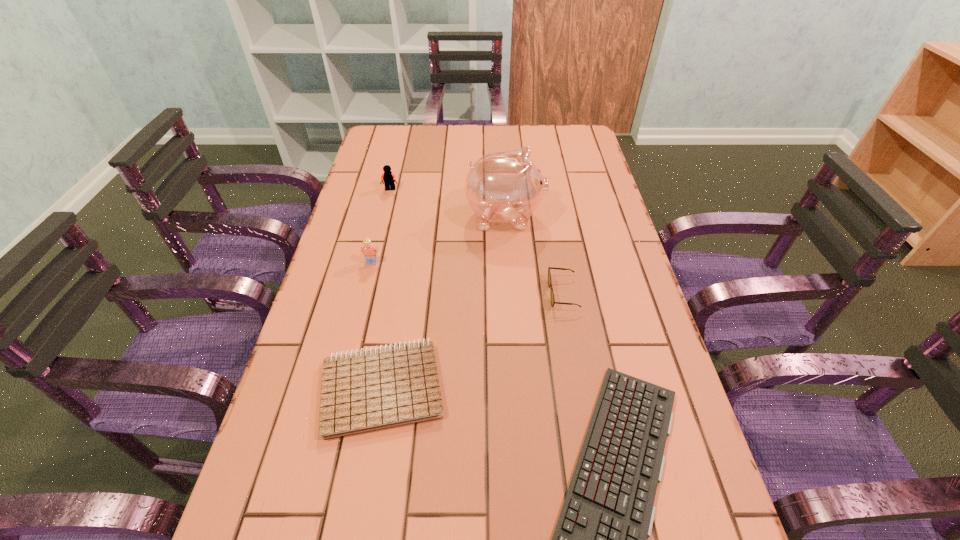
Locate an element on the screen. Image resolution: width=960 pixels, height=540 pixels. free space that satisfies the following two spatial constraints: 1. on the front facing side of the tallest object; 2. on the front-facing side of the farther Lego is located at coordinates (503, 190).

The width and height of the screenshot is (960, 540). Find the location of `vacant area in the image that satisfies the following two spatial constraints: 1. on the front-facing side of the farther Lego; 2. on the front facing side of the piggy bank`. vacant area in the image that satisfies the following two spatial constraints: 1. on the front-facing side of the farther Lego; 2. on the front facing side of the piggy bank is located at coordinates (384, 216).

Find the location of a particular element. free point that satisfies the following two spatial constraints: 1. on the back side of the notebook; 2. on the front facing side of the second farthest object is located at coordinates (412, 216).

The height and width of the screenshot is (540, 960). I want to click on free region that satisfies the following two spatial constraints: 1. on the front-facing side of the sunglasses; 2. on the front side of the notebook, so click(x=580, y=387).